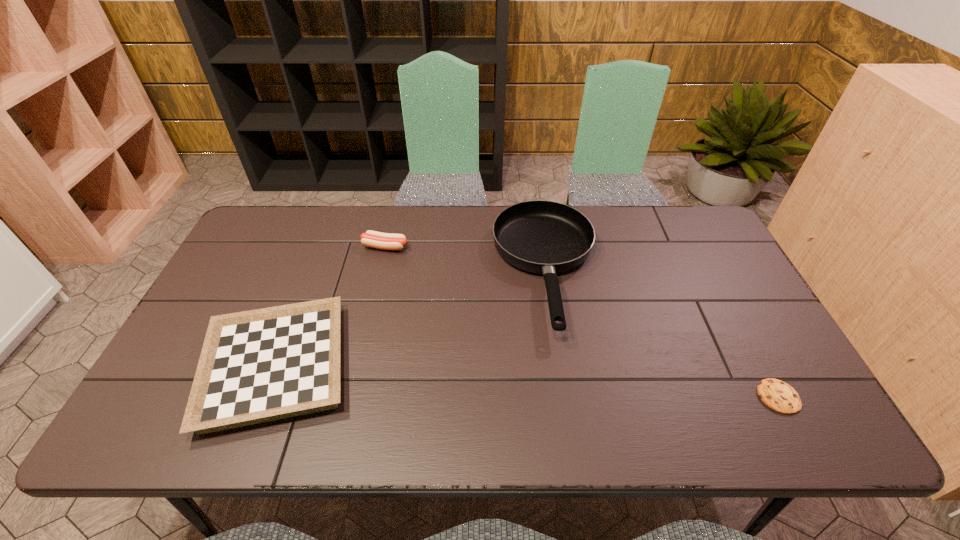
Identify the location of blank space at the left edge of the desktop. The height and width of the screenshot is (540, 960). (251, 291).

Image resolution: width=960 pixels, height=540 pixels. In the image, there is a desktop. Identify the location of vacant space at the right edge. (736, 302).

The width and height of the screenshot is (960, 540). In the image, there is a desktop. In order to click on vacant space at the far left corner in this screenshot , I will do `click(298, 233)`.

Identify the location of free spot between the sausage and the tallest object. (466, 258).

Where is `vacant space that is in between the checkerboard and the cookie`? This screenshot has height=540, width=960. vacant space that is in between the checkerboard and the cookie is located at coordinates (527, 382).

The image size is (960, 540). Find the location of `vacant space that's between the checkerboard and the second object from right to left`. vacant space that's between the checkerboard and the second object from right to left is located at coordinates (411, 318).

Where is `unoccupied position between the third object from left to right and the checkerboard`? The width and height of the screenshot is (960, 540). unoccupied position between the third object from left to right and the checkerboard is located at coordinates (411, 318).

The width and height of the screenshot is (960, 540). I want to click on unoccupied position between the checkerboard and the cookie, so click(527, 382).

Locate an element on the screen. This screenshot has width=960, height=540. free area in between the sausage and the rightmost object is located at coordinates (582, 322).

Image resolution: width=960 pixels, height=540 pixels. What are the coordinates of `empty location between the checkerboard and the tallest object` in the screenshot? It's located at (411, 318).